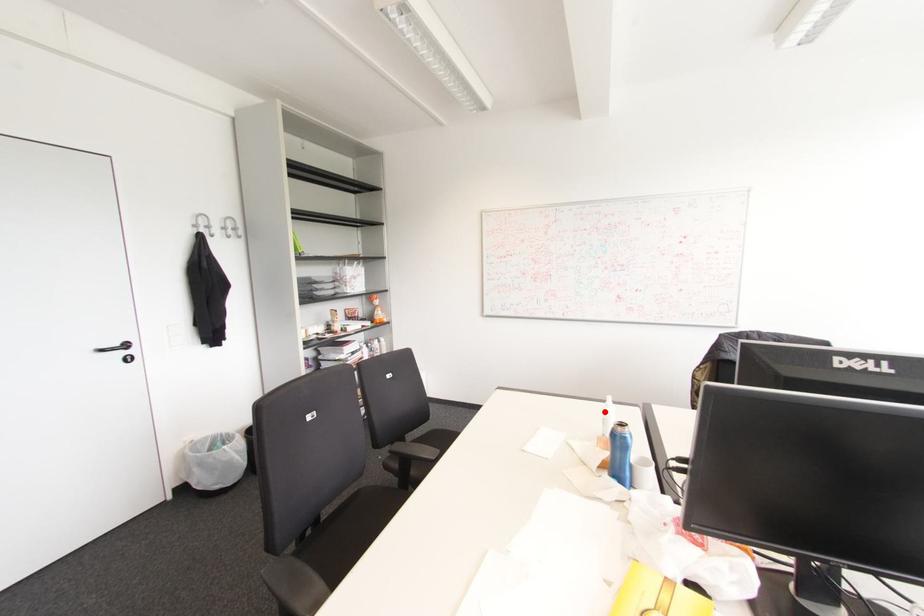
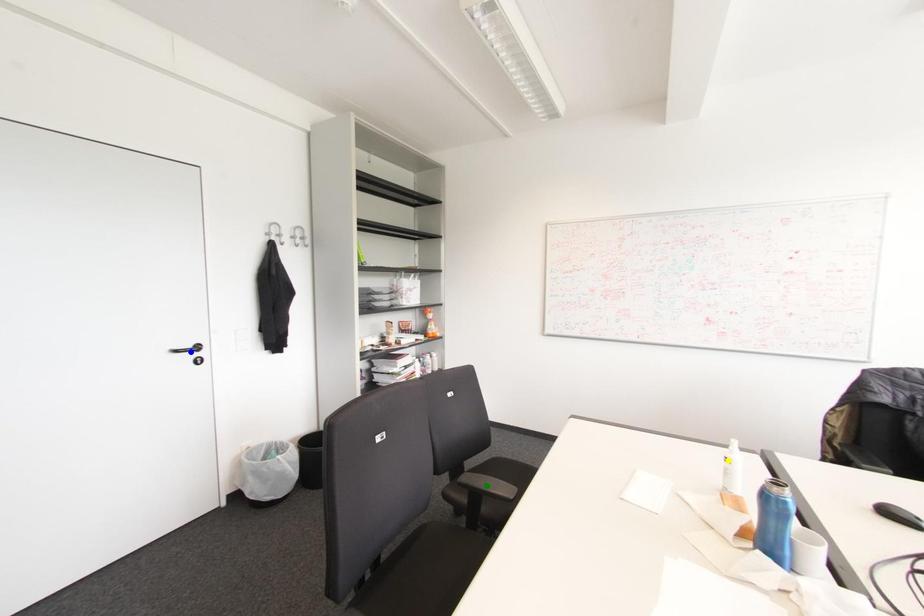
Question: I am providing you with two images of the same scene from different viewpoints. A red point is marked on the first image. You are given multiple points on the second image. Which point in image 2 is actually the same real-world point as the red point in image 1?

Choices:
 (A) green point
 (B) yellow point
 (C) blue point

Answer: (B)